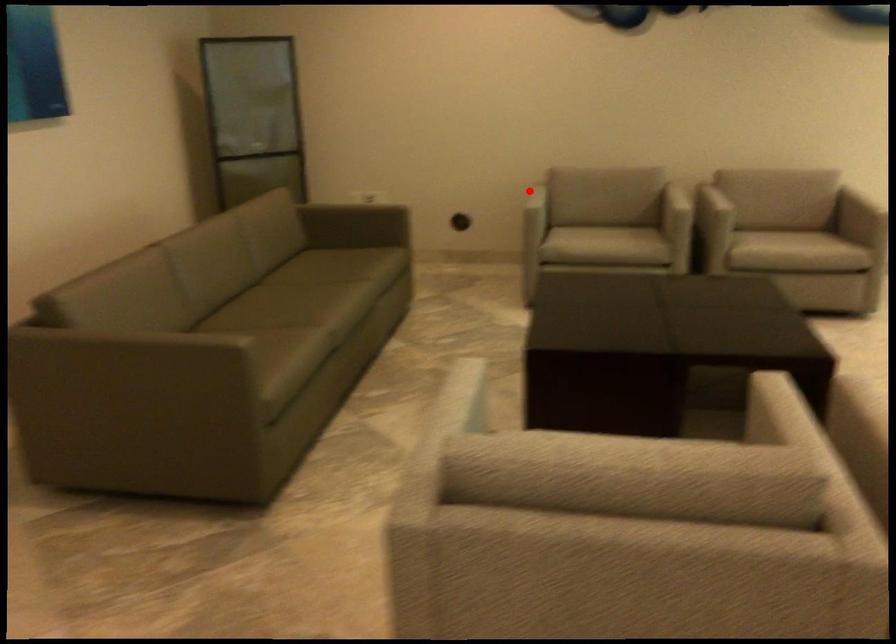
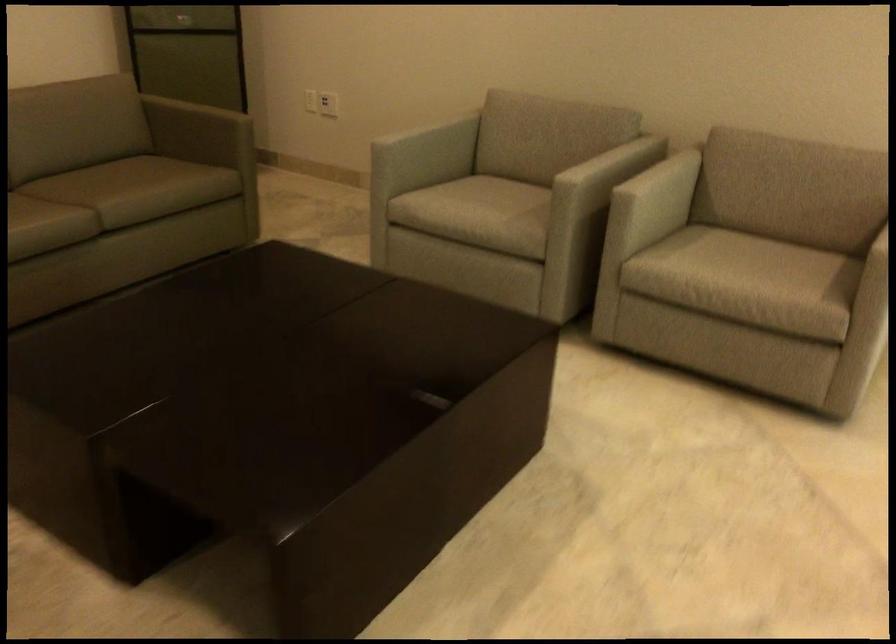
Find the pixel in the second image that matches the highlighted location in the first image.

(423, 127)